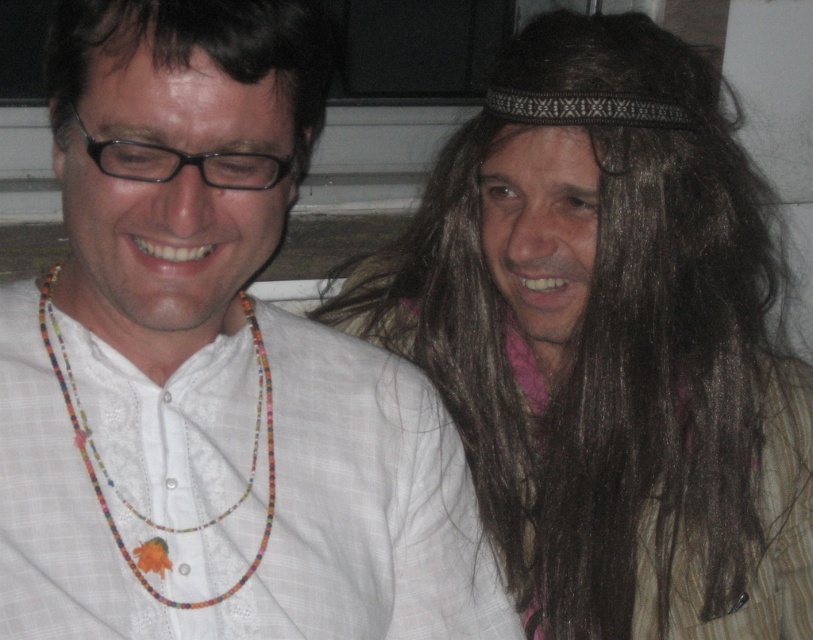
Question: From the image, what is the correct spatial relationship of brown hair at upper right in relation to dark brown hair at upper left?

Choices:
 (A) above
 (B) below

Answer: (B)

Question: Which point is closer to the camera taking this photo?

Choices:
 (A) (241, 54)
 (B) (285, 116)
 (C) (254, 561)

Answer: (A)

Question: Does dark brown hair at upper left have a smaller size compared to beaded necklace at left?

Choices:
 (A) yes
 (B) no

Answer: (A)

Question: Does white woven shirt at center have a lesser width compared to dark brown hair at upper left?

Choices:
 (A) no
 (B) yes

Answer: (A)

Question: Among these points, which one is farthest from the camera?

Choices:
 (A) (292, 24)
 (B) (311, 145)
 (C) (153, 522)

Answer: (B)

Question: Among these objects, which one is farthest from the camera?

Choices:
 (A) brown hair at upper right
 (B) white woven shirt at center
 (C) dark brown hair at upper left

Answer: (A)